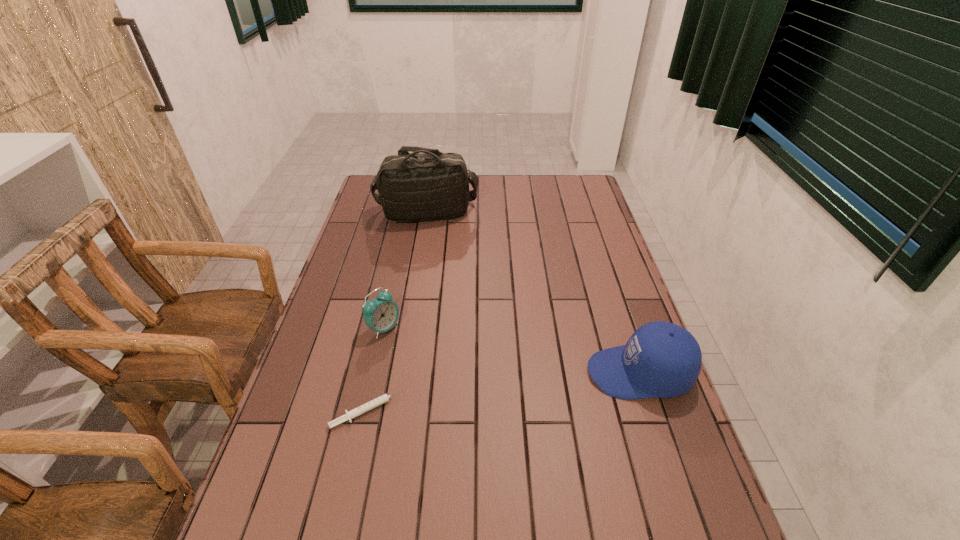
You are a GUI agent. You are given a task and a screenshot of the screen. Output one action in this format:
    pyautogui.click(x=<x>, y=<y>)
    Task: Click on the object at the far left corner
    The image size is (960, 540).
    Given the screenshot: What is the action you would take?
    pyautogui.click(x=426, y=185)

This screenshot has height=540, width=960. I want to click on vacant region at the far edge of the desktop, so click(482, 187).

Where is `vacant space at the near edge`? Image resolution: width=960 pixels, height=540 pixels. vacant space at the near edge is located at coordinates (530, 507).

Locate an element on the screen. This screenshot has height=540, width=960. vacant space at the left edge of the desktop is located at coordinates (363, 325).

In the image, there is a desktop. At what (x,y) coordinates should I click in order to perform the action: click on vacant space at the right edge. Please return your answer as a coordinate pair (x, y). Image resolution: width=960 pixels, height=540 pixels. Looking at the image, I should click on (634, 409).

Identify the location of vacant space at the near left corner of the desktop. This screenshot has height=540, width=960. (284, 503).

Where is `free space between the rightmost object and the shortest object`? The image size is (960, 540). free space between the rightmost object and the shortest object is located at coordinates 504,392.

Identify the location of free space between the rightmost object and the second farthest object. This screenshot has height=540, width=960. click(512, 350).

Locate an element on the screen. This screenshot has width=960, height=540. vacant region between the cap and the syringe is located at coordinates (504, 392).

At what (x,y) coordinates should I click in order to perform the action: click on unoccupied position between the alarm clock and the cap. Please return your answer as a coordinate pair (x, y). Looking at the image, I should click on (512, 350).